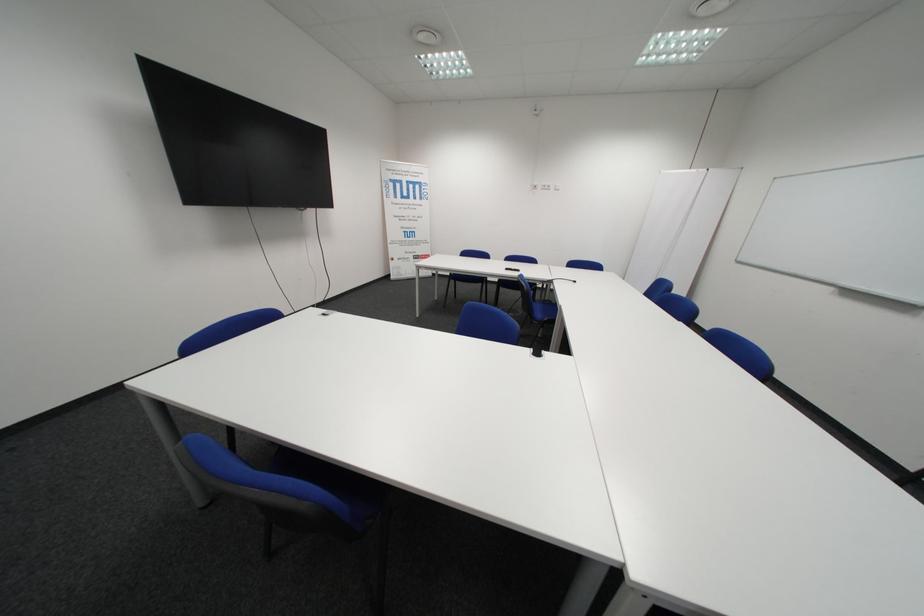
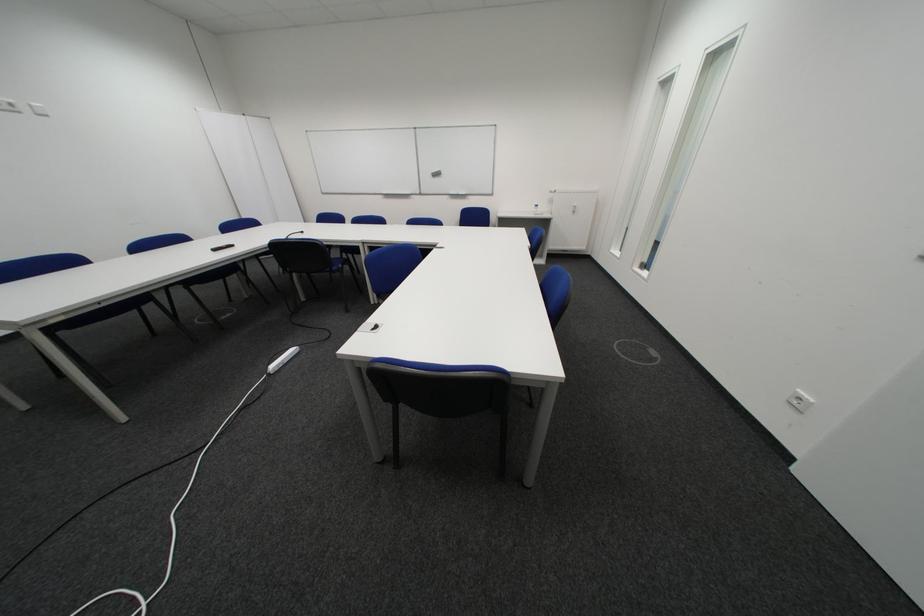
In the second image, find the point that corresponds to point (554, 188) in the first image.

(8, 108)